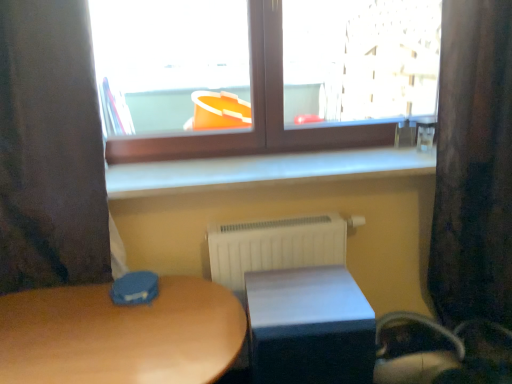
Question: Which direction should I rotate to look at matte wooden table at center, the second table positioned from the right?

Choices:
 (A) left
 (B) right

Answer: (A)

Question: Could brown wooden window at upper center be considered to be inside matte wooden table at center, arranged as the 1th table when viewed from the left?

Choices:
 (A) yes
 (B) no

Answer: (B)

Question: Is matte wooden table at center, arranged as the 1th table when viewed from the left, behind brown wooden window at upper center?

Choices:
 (A) yes
 (B) no

Answer: (B)

Question: From a real-world perspective, is matte wooden table at center, the second table positioned from the right, beneath brown wooden window at upper center?

Choices:
 (A) yes
 (B) no

Answer: (A)

Question: Is matte wooden table at center, the second table positioned from the right, next to brown wooden window at upper center and touching it?

Choices:
 (A) yes
 (B) no

Answer: (B)

Question: Would you say matte wooden table at center, arranged as the 1th table when viewed from the left, is outside brown wooden window at upper center?

Choices:
 (A) no
 (B) yes

Answer: (B)

Question: Can you confirm if matte wooden table at center, the second table positioned from the right, is thinner than brown wooden window at upper center?

Choices:
 (A) yes
 (B) no

Answer: (B)

Question: From the image's perspective, would you say white smooth window sill at center is shown under brown wooden window at upper center?

Choices:
 (A) yes
 (B) no

Answer: (A)

Question: Does white smooth window sill at center turn towards brown wooden window at upper center?

Choices:
 (A) no
 (B) yes

Answer: (A)

Question: Is brown wooden window at upper center completely or partially inside white smooth window sill at center?

Choices:
 (A) yes
 (B) no

Answer: (B)

Question: Can you confirm if white smooth window sill at center is wider than brown wooden window at upper center?

Choices:
 (A) no
 (B) yes

Answer: (B)

Question: Considering the relative sizes of white smooth window sill at center and brown wooden window at upper center in the image provided, is white smooth window sill at center taller than brown wooden window at upper center?

Choices:
 (A) no
 (B) yes

Answer: (A)

Question: Is white smooth window sill at center touching brown wooden window at upper center?

Choices:
 (A) yes
 (B) no

Answer: (B)

Question: From the image's perspective, is velvet dark brown curtain at right, the 2th curtain viewed from the left, above dark fabric curtain at left, positioned as the 2th curtain in right-to-left order?

Choices:
 (A) no
 (B) yes

Answer: (A)